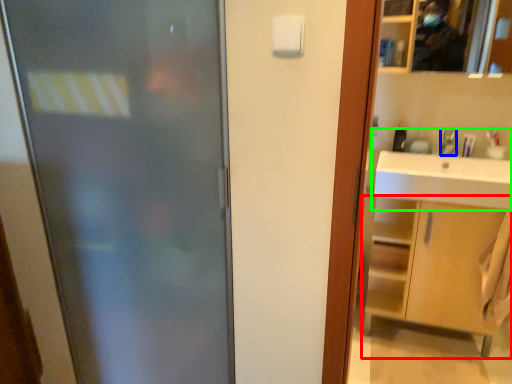
Question: Which object is positioned farthest from bathroom cabinet (highlighted by a red box)? Select from faucet (highlighted by a blue box) and sink (highlighted by a green box).

Choices:
 (A) faucet
 (B) sink

Answer: (A)